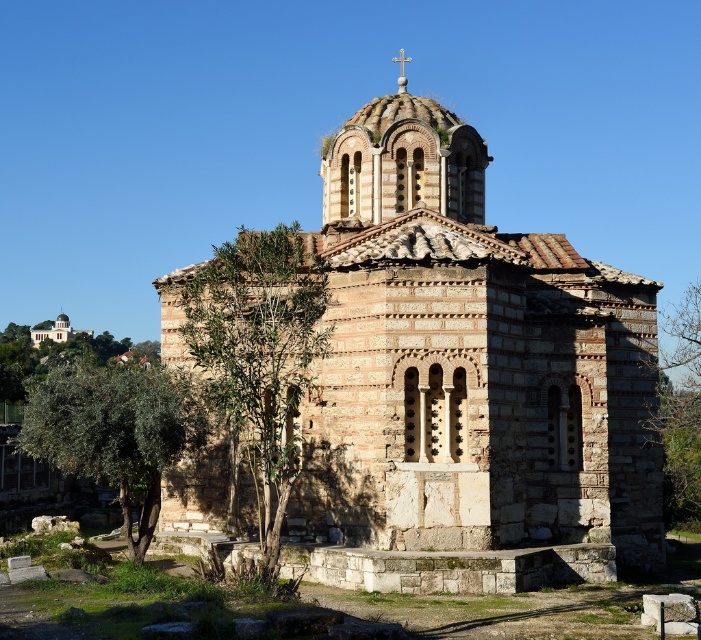
I want to click on stone chapel at center, so click(x=468, y=362).

Is stone chapel at center thinner than green leafy tree at center?

No, stone chapel at center is not thinner than green leafy tree at center.

Does point (388, 432) come behind point (229, 369)?

Yes, point (388, 432) is farther from viewer.

Identify the location of stone chapel at center. The image size is (701, 640). (468, 362).

Is green leafy tree at center below green leafy tree at lower left?

No, green leafy tree at center is not below green leafy tree at lower left.

Who is shorter, green leafy tree at center or green leafy tree at lower left?

green leafy tree at lower left is shorter.

Looking at this image, who is more forward, (240, 346) or (69, 465)?

Point (240, 346) is more forward.

The height and width of the screenshot is (640, 701). Identify the location of green leafy tree at center. (259, 355).

Who is positioned more to the left, stone chapel at center or green leafy tree at right?

From the viewer's perspective, stone chapel at center appears more on the left side.

Between point (400, 358) and point (700, 289), which one is positioned in front?

Point (400, 358) is more forward.

Identify the location of stone chapel at center. (468, 362).